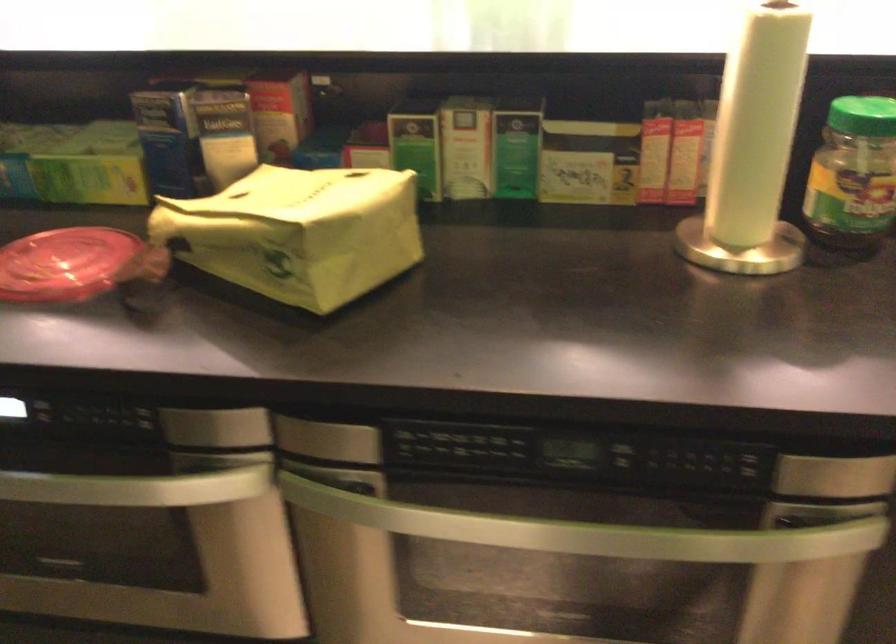
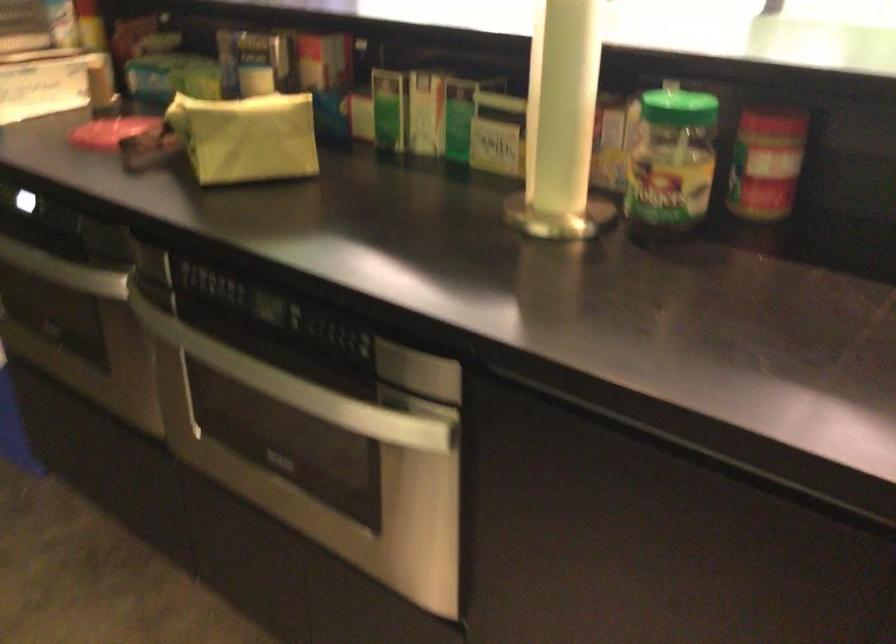
The point at (143,491) is marked in the first image. Where is the corresponding point in the second image?

(64, 270)